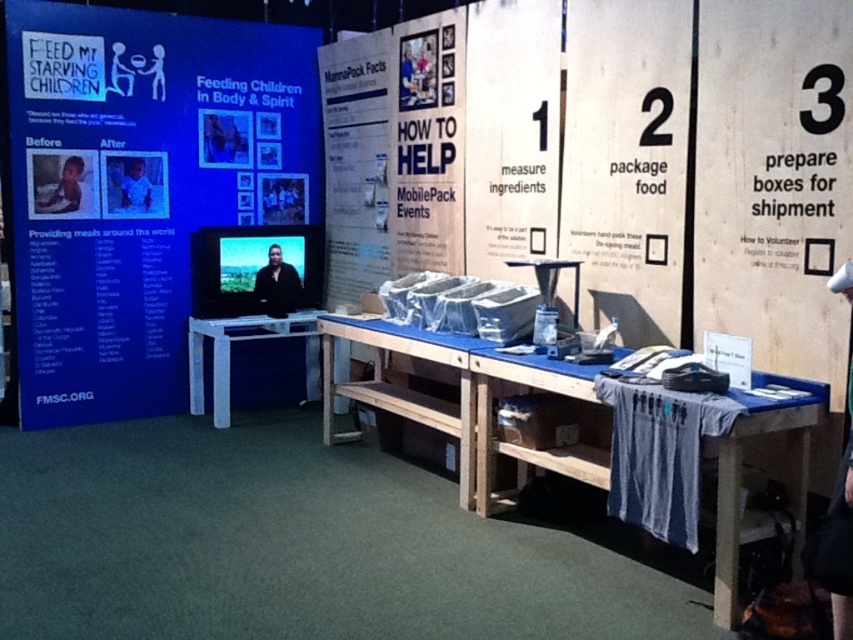
Question: Which object is positioned closest to the white plastic table at lower left?

Choices:
 (A) blue fabric-covered table at lower right
 (B) white paper at center

Answer: (B)

Question: Which point is closer to the camera?

Choices:
 (A) (271, 310)
 (B) (593, 472)
 (C) (285, 51)
 (D) (140, 168)

Answer: (B)

Question: Is white plastic table at lower left wider than matte black shirt at left?

Choices:
 (A) yes
 (B) no

Answer: (A)

Question: Which point is farther from the camera taking this photo?

Choices:
 (A) (299, 300)
 (B) (140, 208)
 (C) (422, 115)

Answer: (A)

Question: Can you confirm if black matte shirt at center is positioned to the right of matte black shirt at left?

Choices:
 (A) no
 (B) yes

Answer: (B)

Question: Does wooden table at center appear on the left side of black matte shirt at center?

Choices:
 (A) no
 (B) yes

Answer: (A)